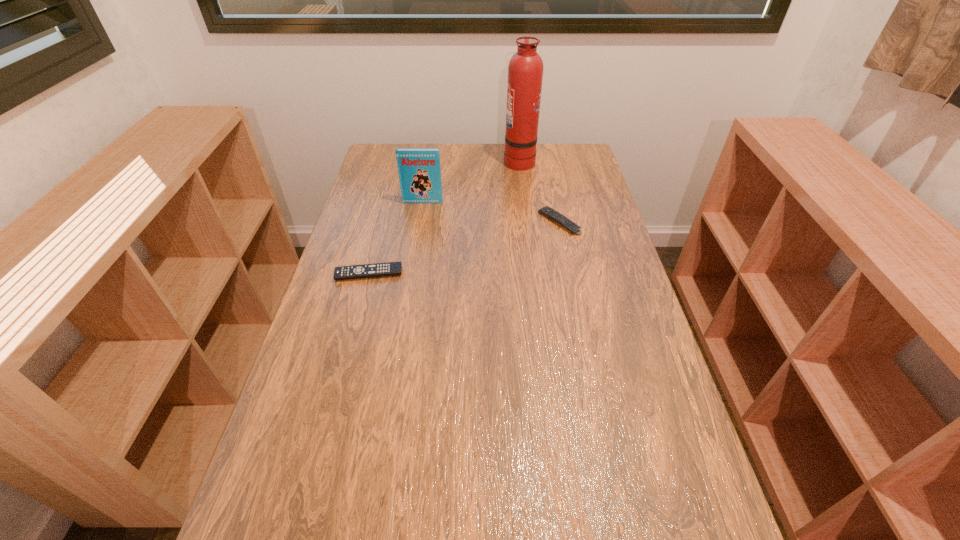
I want to click on free space located on the label side of the fire extinguisher, so click(465, 160).

Find the location of a particular element. The width and height of the screenshot is (960, 540). vacant region located on the front cover of the second farthest object is located at coordinates (417, 239).

At what (x,y) coordinates should I click in order to perform the action: click on free location located on the front of the farther remote control. Please return your answer as a coordinate pair (x, y). This screenshot has width=960, height=540. Looking at the image, I should click on (564, 248).

The width and height of the screenshot is (960, 540). What are the coordinates of `free space located on the back of the left remote control` in the screenshot? It's located at (387, 206).

This screenshot has height=540, width=960. I want to click on object at the far edge, so click(x=525, y=71).

Where is `book at the left edge`? The height and width of the screenshot is (540, 960). book at the left edge is located at coordinates (419, 170).

Where is `remote control that is at the left edge`? The image size is (960, 540). remote control that is at the left edge is located at coordinates [x=391, y=268].

This screenshot has width=960, height=540. I want to click on object that is positioned at the right edge, so click(546, 211).

This screenshot has width=960, height=540. I want to click on free space at the far edge, so click(540, 154).

You are a GUI agent. You are given a task and a screenshot of the screen. Output one action in this format:
    pyautogui.click(x=<x>, y=<y>)
    Task: Click on the vacant space at the left edge of the desktop
    
    Given the screenshot: What is the action you would take?
    pyautogui.click(x=357, y=237)